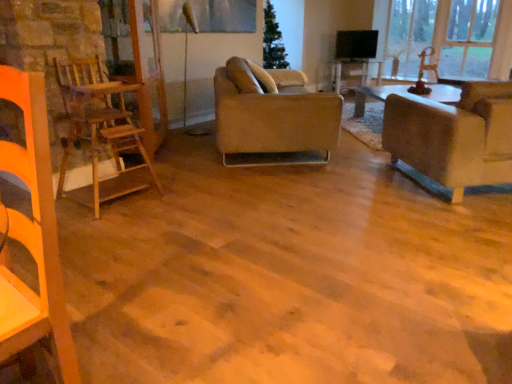
Question: Is metallic glass window screen at upper center closer to the viewer compared to transparent glass window at upper right?

Choices:
 (A) no
 (B) yes

Answer: (B)

Question: Would you consider metallic glass window screen at upper center to be distant from transparent glass window at upper right?

Choices:
 (A) no
 (B) yes

Answer: (B)

Question: Is metallic glass window screen at upper center wider than transparent glass window at upper right?

Choices:
 (A) no
 (B) yes

Answer: (A)

Question: Does metallic glass window screen at upper center appear on the left side of transparent glass window at upper right?

Choices:
 (A) no
 (B) yes

Answer: (B)

Question: Can you confirm if metallic glass window screen at upper center is taller than transparent glass window at upper right?

Choices:
 (A) no
 (B) yes

Answer: (A)

Question: Can you confirm if metallic glass window screen at upper center is shorter than transparent glass window at upper right?

Choices:
 (A) no
 (B) yes

Answer: (B)

Question: Is matte beige couch at right, the second studio couch when ordered from left to right, positioned beyond the bounds of wooden table at center?

Choices:
 (A) no
 (B) yes

Answer: (B)

Question: Could you tell me if matte beige couch at right, the 1th studio couch viewed from the right, is turned towards wooden table at center?

Choices:
 (A) yes
 (B) no

Answer: (A)

Question: Does matte beige couch at right, the 1th studio couch viewed from the right, have a lesser width compared to wooden table at center?

Choices:
 (A) yes
 (B) no

Answer: (B)

Question: Can you confirm if matte beige couch at right, the second studio couch when ordered from left to right, is smaller than wooden table at center?

Choices:
 (A) no
 (B) yes

Answer: (A)

Question: From the image's perspective, does matte beige couch at right, the 1th studio couch viewed from the right, appear lower than wooden table at center?

Choices:
 (A) yes
 (B) no

Answer: (A)

Question: Considering the relative sizes of matte beige couch at right, the 1th studio couch viewed from the right, and wooden table at center in the image provided, is matte beige couch at right, the 1th studio couch viewed from the right, wider than wooden table at center?

Choices:
 (A) no
 (B) yes

Answer: (B)

Question: Considering the relative sizes of wooden table at center and leather couch at center, the 1th studio couch from the left, in the image provided, is wooden table at center taller than leather couch at center, the 1th studio couch from the left,?

Choices:
 (A) no
 (B) yes

Answer: (A)